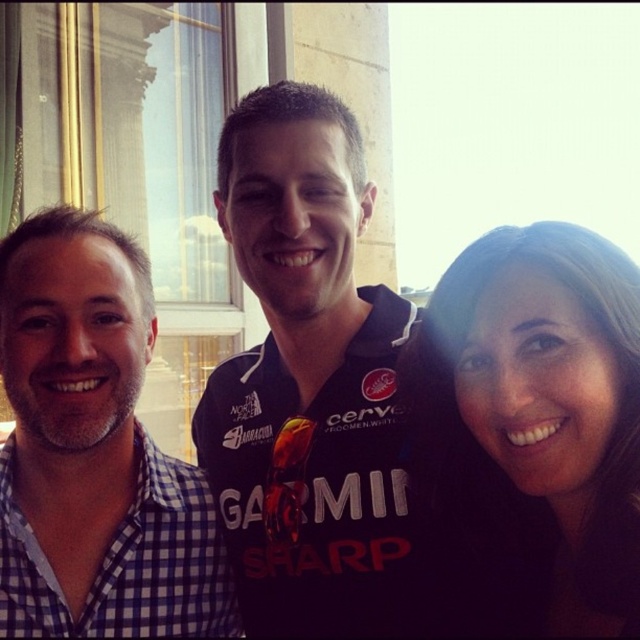
Can you confirm if brown hair at center is shorter than blue jersey at center?

Yes, brown hair at center is shorter than blue jersey at center.

In order to click on brown hair at center in this screenshot , I will do `click(540, 420)`.

The image size is (640, 640). I want to click on brown hair at center, so click(x=540, y=420).

Which is below, dark blue jersey at center or blue jersey at center?

blue jersey at center is lower down.

Based on the photo, how distant is dark blue jersey at center from blue jersey at center?

The distance of dark blue jersey at center from blue jersey at center is 22.21 inches.

Who is more forward, [330,432] or [45,497]?

Point [45,497] is in front.

You are a GUI agent. You are given a task and a screenshot of the screen. Output one action in this format:
    pyautogui.click(x=<x>, y=<y>)
    Task: Click on the dark blue jersey at center
    This screenshot has height=640, width=640.
    Given the screenshot: What is the action you would take?
    pyautogui.click(x=310, y=388)

Between point (300, 595) and point (506, 371), which one is positioned behind?

The point (300, 595) is behind.

Who is more forward, (269, 284) or (632, 301)?

Positioned in front is point (632, 301).

Find the location of `dark blue jersey at center`. dark blue jersey at center is located at coordinates (310, 388).